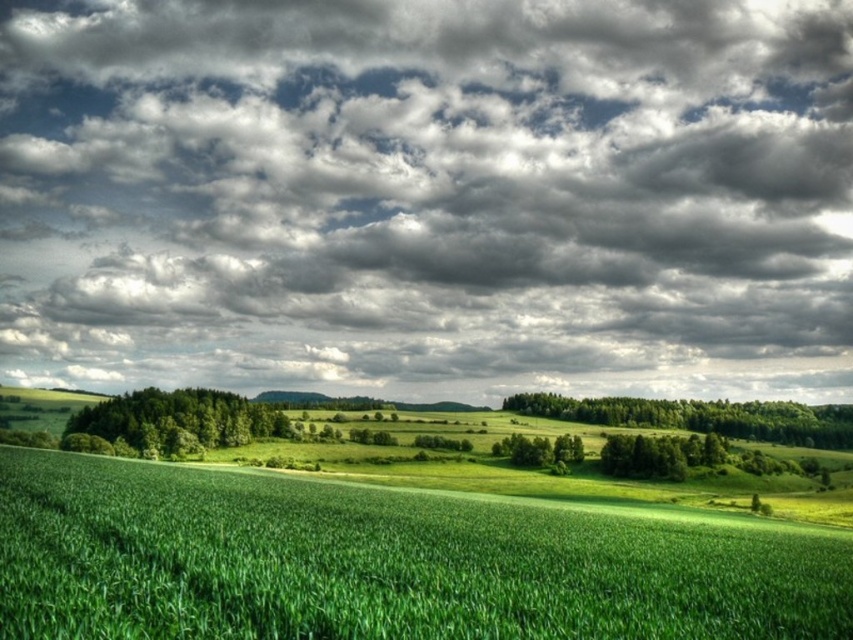
You are an artist painting this landscape. You want to place the green leafy tree at center in your painting so that it appears to the right of the cloudy sky at upper center. Is this possible based on the scene?

No, because the cloudy sky at upper center is already to the left of the green leafy tree at center in the scene.

You are an airplane pilot preparing to land in this area. You notice the cloudy sky at upper center and the green leafy tree at center. Which object would you need to consider for potential weather conditions affecting your landing?

The cloudy sky at upper center is much taller than the green leafy tree at center, so it is the object that indicates potential weather conditions affecting the landing.